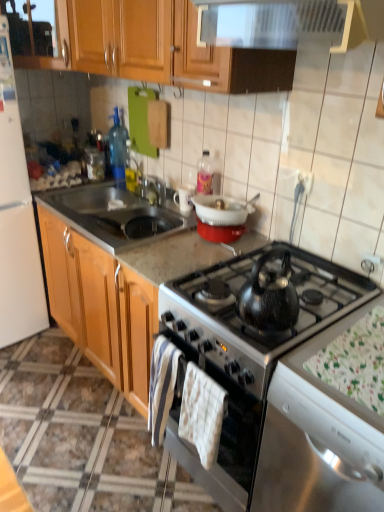
The height and width of the screenshot is (512, 384). What are the coordinates of `vacant area on top of shiny metallic kettle at center-right (from a real-world perspective)` in the screenshot? It's located at (356, 355).